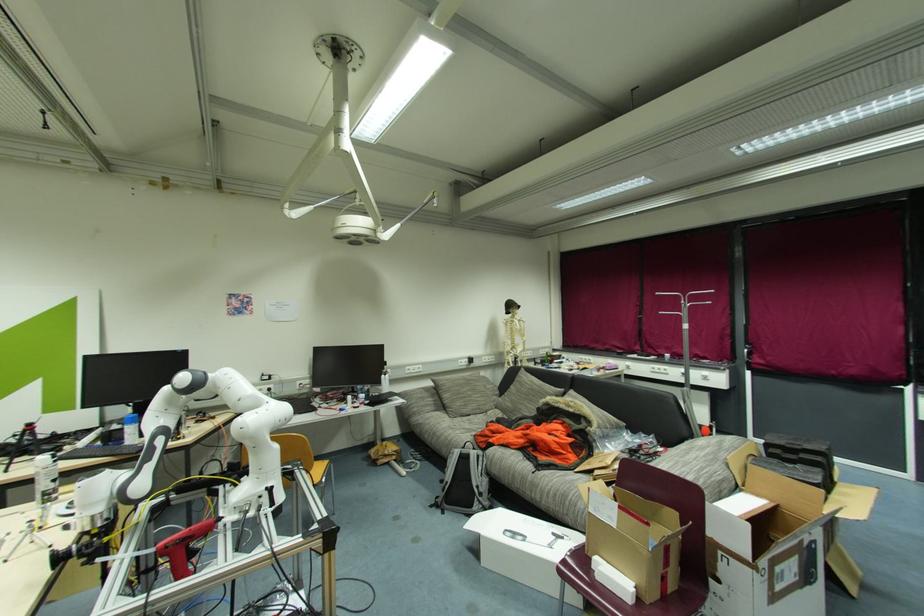
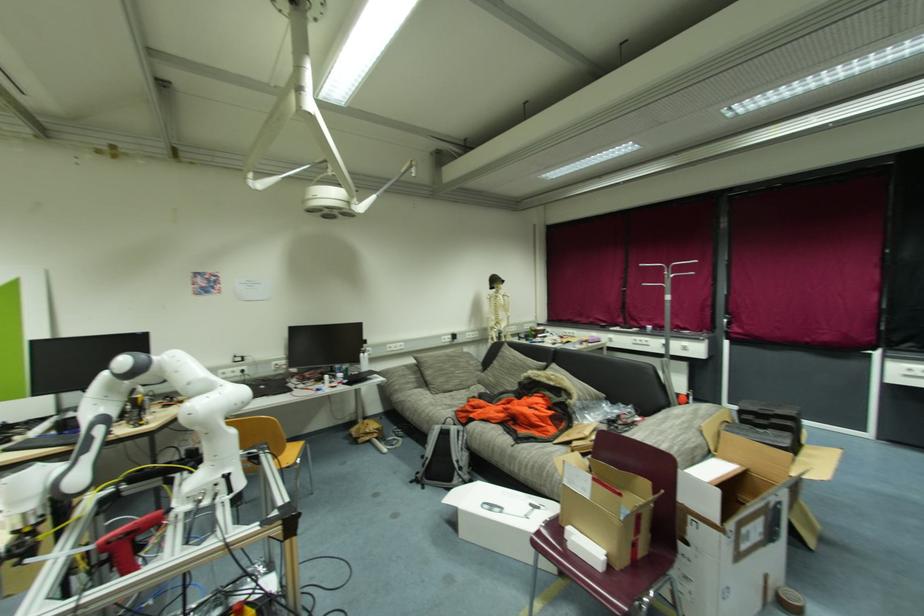
From the picture: Which direction would the cameraman need to move to produce the second image?

The cameraman walked toward right, forward.